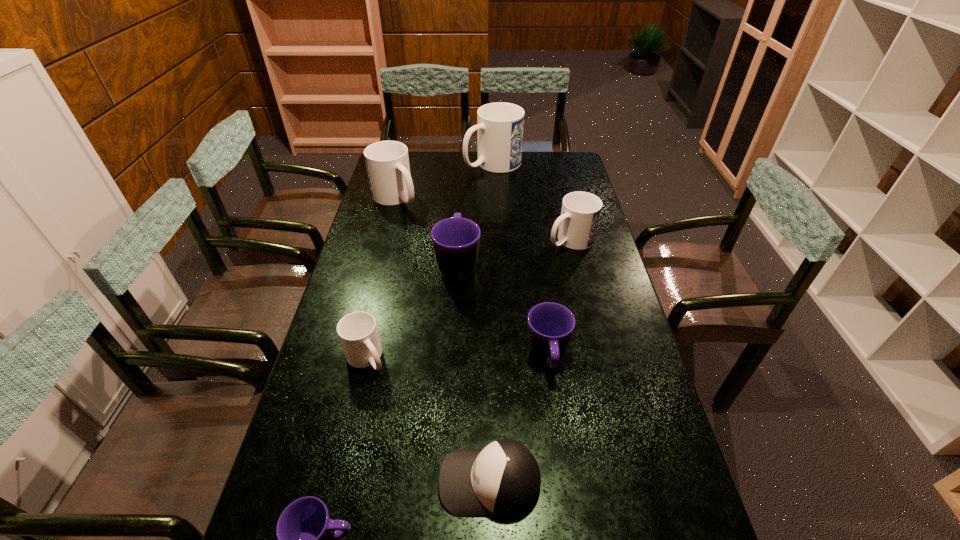
Point out which blue mug is positioned as the third nearest to the smallest black mug. Please provide its 2D coordinates. Your answer should be formatted as a tuple, i.e. [(x, y)], where the tuple contains the x and y coordinates of a point satisfying the conditions above.

[(387, 162)]

At what (x,y) coordinates should I click in order to perform the action: click on blue mug that stands as the closest to the farthest blue mug. Please return your answer as a coordinate pair (x, y). Looking at the image, I should click on (387, 162).

Point out which black mug is positioned as the second nearest to the nearest blue mug. Please provide its 2D coordinates. Your answer should be formatted as a tuple, i.e. [(x, y)], where the tuple contains the x and y coordinates of a point satisfying the conditions above.

[(305, 532)]

The width and height of the screenshot is (960, 540). I want to click on the closest black mug to the smallest black mug, so click(551, 325).

Where is `free space that satisfies the following two spatial constraints: 1. on the front side of the third farthest blue mug; 2. on the front panel of the cap`? free space that satisfies the following two spatial constraints: 1. on the front side of the third farthest blue mug; 2. on the front panel of the cap is located at coordinates (629, 482).

Where is `vacant area that satisfies the following two spatial constraints: 1. on the front side of the second tallest mug; 2. on the right side of the smallest blue mug`? vacant area that satisfies the following two spatial constraints: 1. on the front side of the second tallest mug; 2. on the right side of the smallest blue mug is located at coordinates (354, 358).

The image size is (960, 540). Find the location of `free space in the image that satisfies the following two spatial constraints: 1. with the handle on the side of the second blue mug from right to left; 2. on the left side of the farthest black mug`. free space in the image that satisfies the following two spatial constraints: 1. with the handle on the side of the second blue mug from right to left; 2. on the left side of the farthest black mug is located at coordinates (464, 164).